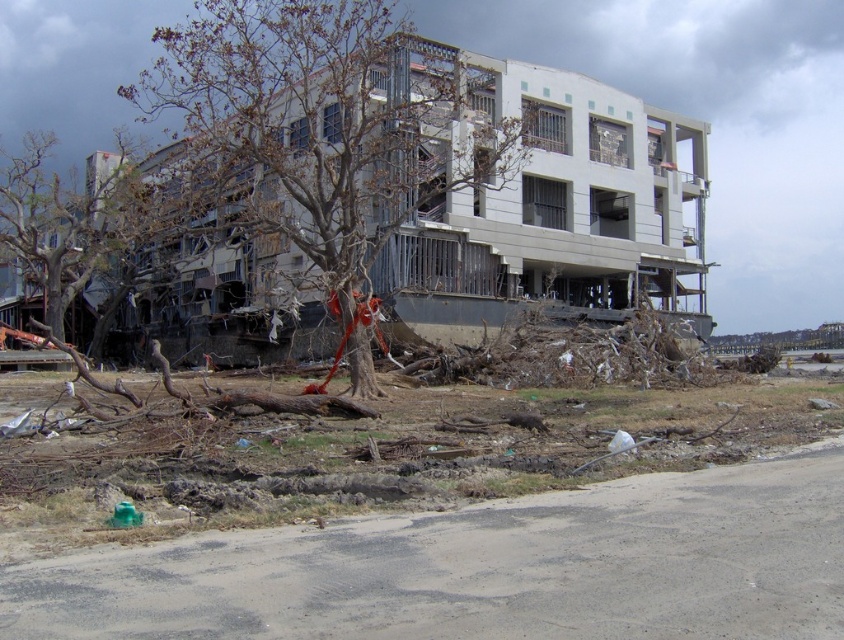
You are a rescue worker trying to reach a survivor trapped in the building. You notice a brown leafless tree at center and a bare wood tree at left. Which tree is closer to the collapsed building?

The brown leafless tree at center is positioned over the bare wood tree at left, meaning it is closer to the collapsed building.

You are standing at the point marked by the coordinates point (326, 129), which is the brown leafless tree at center. You want to walk to the nearest safe area. The nearest safe area is the road in the foreground. Which direction should you go to reach the road?

The road is in the foreground, so you should move forward from the brown leafless tree at center towards the road to reach the nearest safe area.